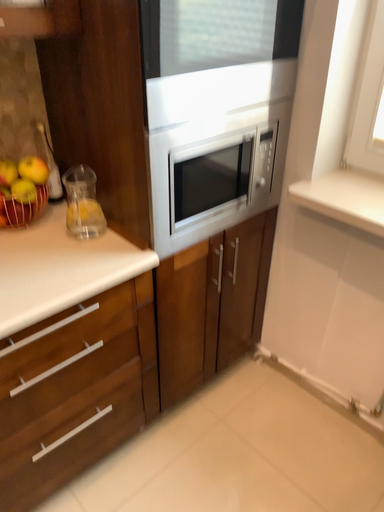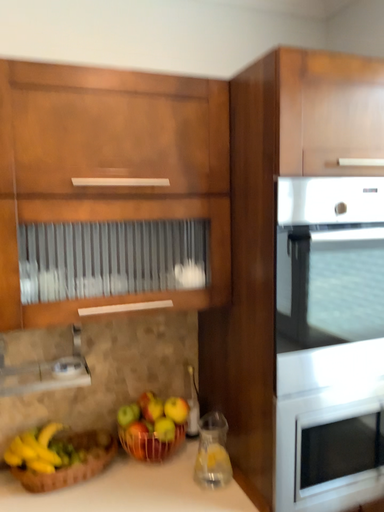
Question: Which way did the camera rotate in the video?

Choices:
 (A) rotated left
 (B) rotated right

Answer: (A)